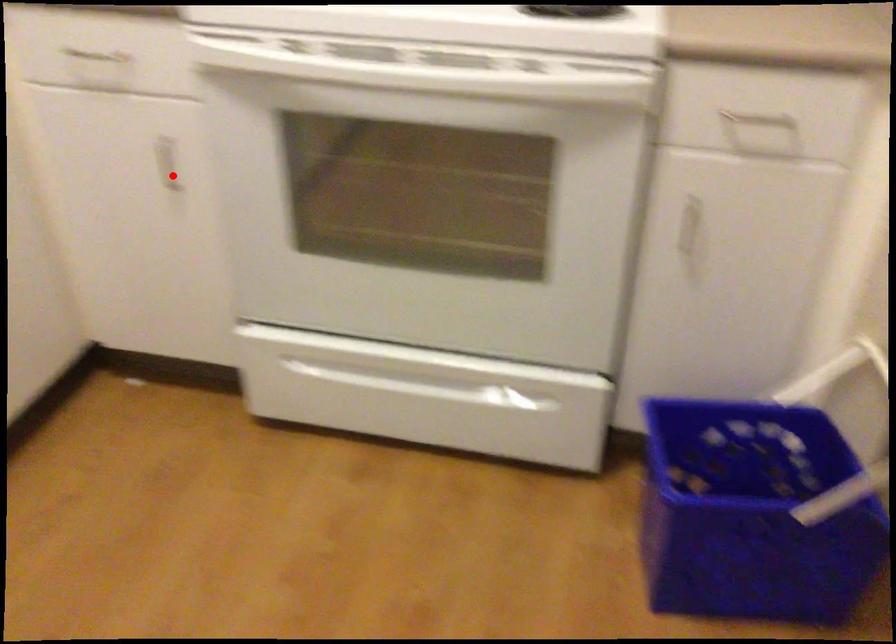
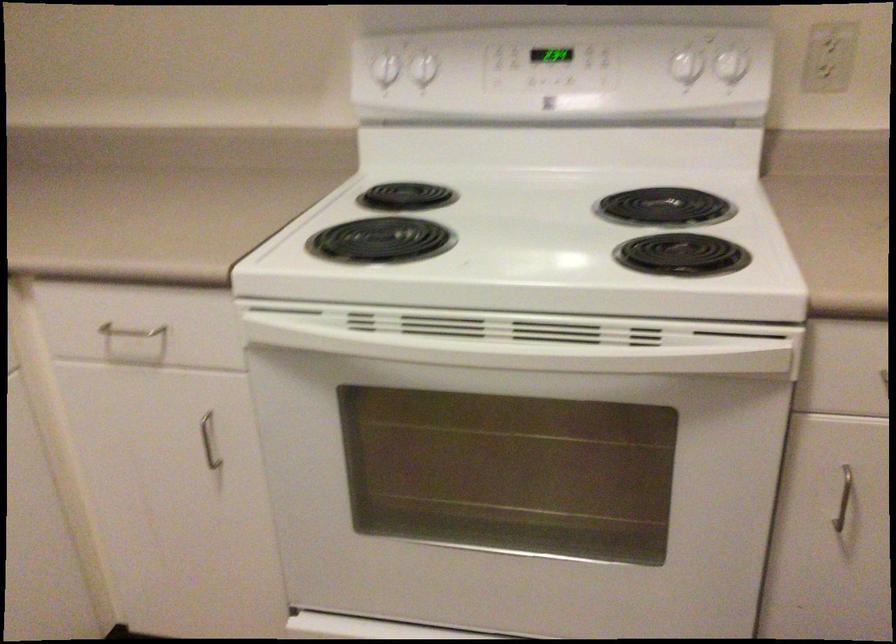
Locate, in the second image, the point that corresponds to the highlighted location in the first image.

(209, 440)